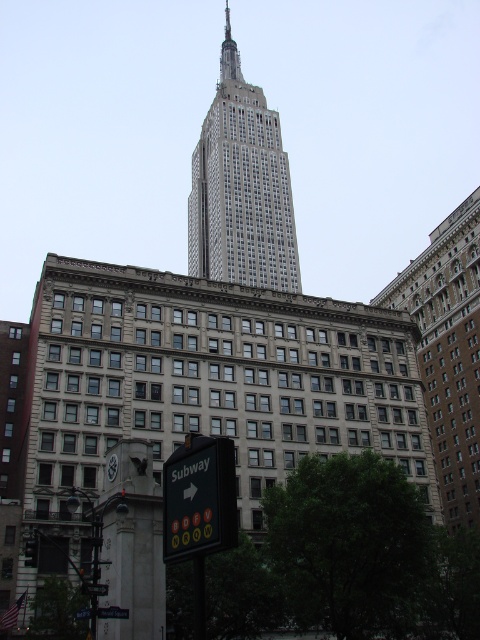
Question: Estimate the real-world distances between objects in this image. Which object is closer to the black plastic subway sign at lower center?

Choices:
 (A) black plastic sign at lower center
 (B) white glass building at center
 (C) metallic traffic light at lower left
 (D) green plastic street sign at lower center

Answer: (D)

Question: Is black plastic sign at lower center further to the viewer compared to black plastic subway sign at lower center?

Choices:
 (A) no
 (B) yes

Answer: (A)

Question: Which point appears closest to the camera in this image?

Choices:
 (A) (88, 616)
 (B) (29, 557)
 (C) (250, 177)
 (D) (112, 609)

Answer: (B)

Question: Does metallic traffic light at lower left have a larger size compared to black plastic subway sign at lower center?

Choices:
 (A) no
 (B) yes

Answer: (B)

Question: Is the position of white glass building at center more distant than that of metallic traffic light at lower left?

Choices:
 (A) no
 (B) yes

Answer: (B)

Question: Which object appears closest to the camera in this image?

Choices:
 (A) metallic traffic light at lower left
 (B) white glass building at center

Answer: (A)